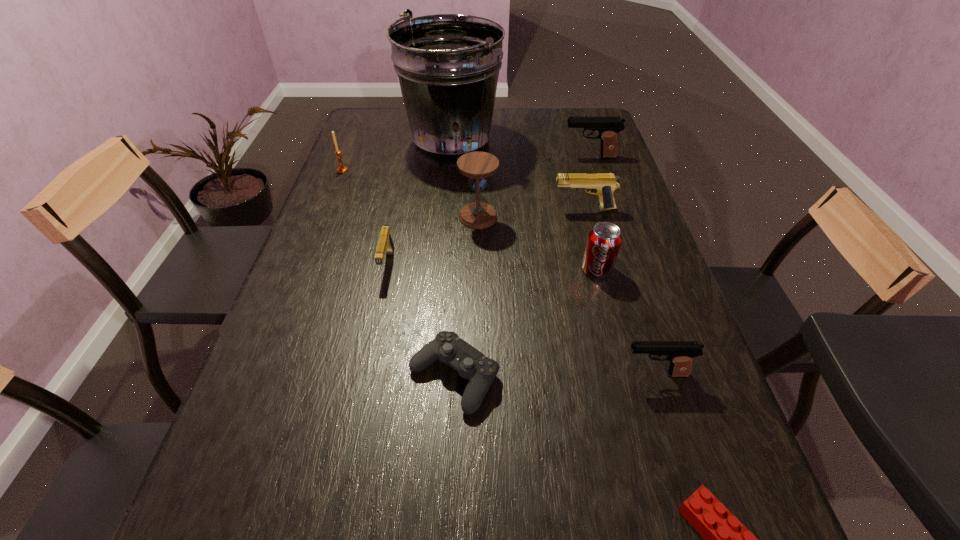
What are the coordinates of `the leftmost pistol` in the screenshot? It's located at (385, 246).

Find the location of a particular element. the second nearest pistol is located at coordinates (385, 246).

Locate an element on the screen. The height and width of the screenshot is (540, 960). control is located at coordinates (470, 363).

This screenshot has width=960, height=540. I want to click on free region located on the right of the bucket, so click(x=530, y=144).

This screenshot has width=960, height=540. I want to click on free spot located 0.310m on the right of the ninth shortest object, so click(x=608, y=217).

Where is `vacant space situated 0.170m at the barrel of the farther black pistol`? This screenshot has width=960, height=540. vacant space situated 0.170m at the barrel of the farther black pistol is located at coordinates (512, 157).

Identify the location of free location located at the barrel of the farther black pistol. The image size is (960, 540). (533, 157).

The height and width of the screenshot is (540, 960). I want to click on free location located 0.190m at the barrel of the farther black pistol, so click(505, 157).

In order to click on vacant area situated on the front of the candle_holder in this screenshot , I will do `click(338, 182)`.

This screenshot has height=540, width=960. In order to click on blank area located 0.220m on the left of the soda can in this screenshot , I will do `click(492, 269)`.